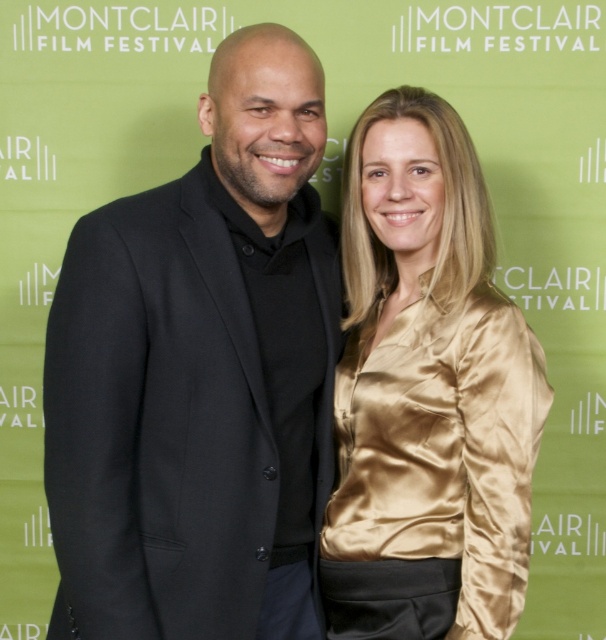
Question: Which point appears closest to the camera in this image?

Choices:
 (A) (430, 224)
 (B) (221, 276)

Answer: (B)

Question: Which point is closer to the camera taking this photo?

Choices:
 (A) (321, 490)
 (B) (401, 625)

Answer: (B)

Question: Does black wool suit at center lie behind gold satin blouse at center?

Choices:
 (A) yes
 (B) no

Answer: (B)

Question: Does black wool suit at center come behind gold satin blouse at center?

Choices:
 (A) no
 (B) yes

Answer: (A)

Question: Considering the relative positions of black wool suit at center and gold satin blouse at center in the image provided, where is black wool suit at center located with respect to gold satin blouse at center?

Choices:
 (A) right
 (B) left

Answer: (B)